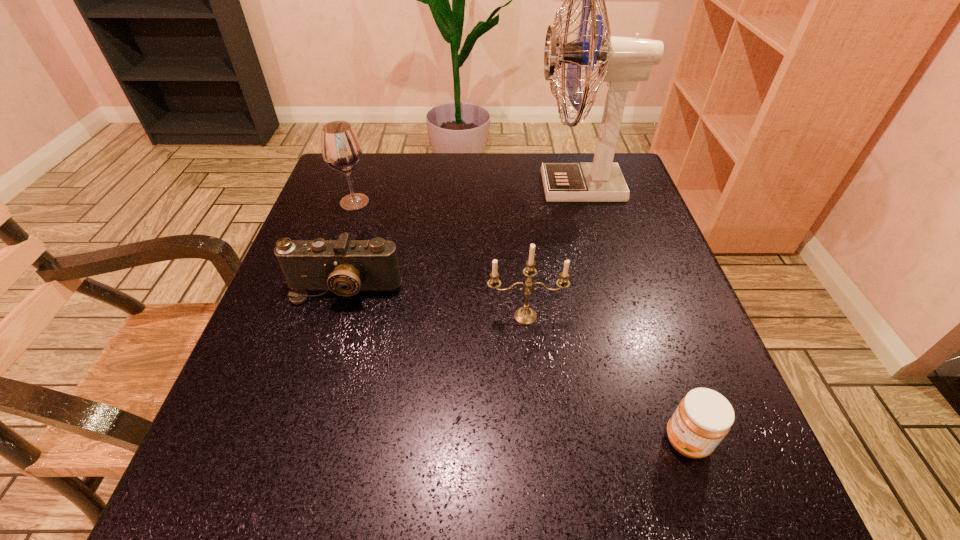
Locate an element on the screen. The height and width of the screenshot is (540, 960). free area in between the nearest object and the candle is located at coordinates point(606,379).

Identify the location of vacant region between the wineglass and the tallest object. (467, 194).

Find the location of `free space that is in between the third nearest object and the nearest object`. free space that is in between the third nearest object and the nearest object is located at coordinates (516, 364).

In order to click on free space between the fourth farthest object and the tallest object in this screenshot , I will do `click(552, 252)`.

The width and height of the screenshot is (960, 540). I want to click on vacant space that is in between the third nearest object and the tallest object, so click(x=462, y=238).

Where is `empty location between the camera and the fan`? The image size is (960, 540). empty location between the camera and the fan is located at coordinates (462, 238).

This screenshot has width=960, height=540. I want to click on free space between the candle and the nearest object, so click(x=606, y=379).

Identify which object is the second closest to the nearest object. Please provide its 2D coordinates. Your answer should be formatted as a tuple, i.e. [(x, y)], where the tuple contains the x and y coordinates of a point satisfying the conditions above.

[(345, 267)]

The width and height of the screenshot is (960, 540). Identify the location of object that is the fourth closest to the wineglass. (704, 417).

Where is `free spot that satisfies the following two spatial constraints: 1. on the front-facing side of the tallest object; 2. on the front-facing side of the third nearest object`? This screenshot has height=540, width=960. free spot that satisfies the following two spatial constraints: 1. on the front-facing side of the tallest object; 2. on the front-facing side of the third nearest object is located at coordinates (609, 289).